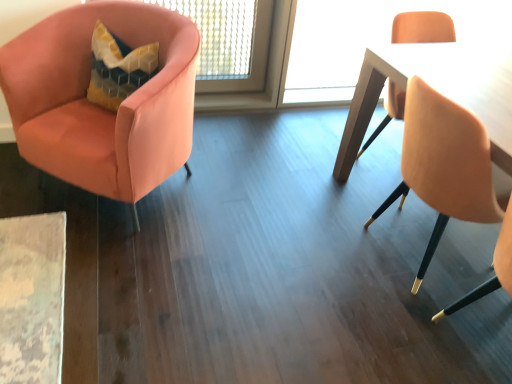
Locate an element on the screen. The image size is (512, 384). vacant region to the left of wooden table at right is located at coordinates (309, 172).